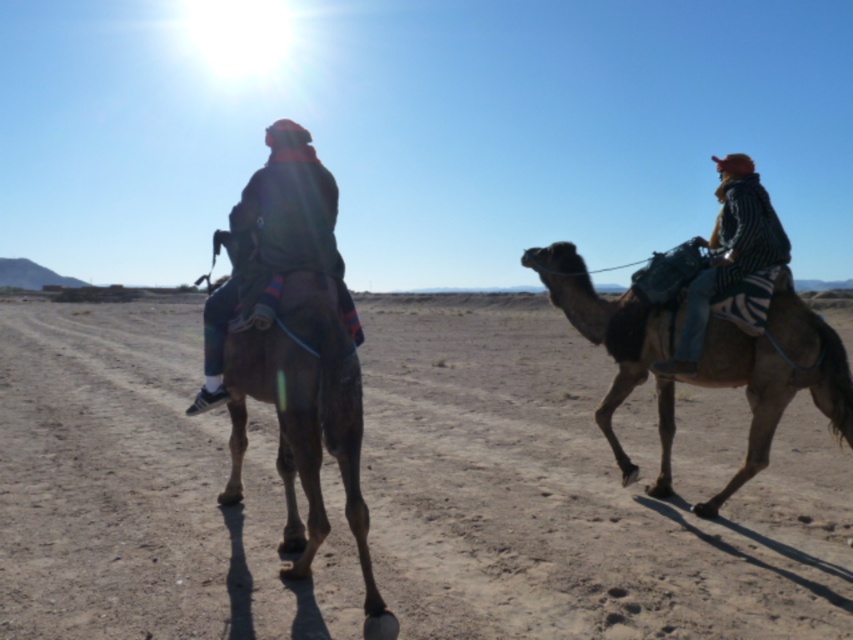
Looking at this image, does brown rough camel at left come behind striped fabric jacket at right?

No, it is in front of striped fabric jacket at right.

Is brown rough camel at left above striped fabric jacket at right?

Incorrect, brown rough camel at left is not positioned above striped fabric jacket at right.

Find the location of a particular element. brown rough camel at left is located at coordinates (306, 422).

Who is positioned more to the right, brown fuzzy camel at right or striped fabric jacket at right?

striped fabric jacket at right is more to the right.

Who is more distant from viewer, (712, 515) or (740, 170)?

The point (740, 170) is behind.

The width and height of the screenshot is (853, 640). I want to click on brown fuzzy camel at right, so click(x=776, y=376).

Is point (236, 428) positioned before point (299, 145)?

No, (236, 428) is behind (299, 145).

Looking at this image, does brown rough camel at left have a greater width compared to dark brown leather jacket at center?

Incorrect, brown rough camel at left's width does not surpass dark brown leather jacket at center's.

Where is `brown rough camel at left`? Image resolution: width=853 pixels, height=640 pixels. brown rough camel at left is located at coordinates click(x=306, y=422).